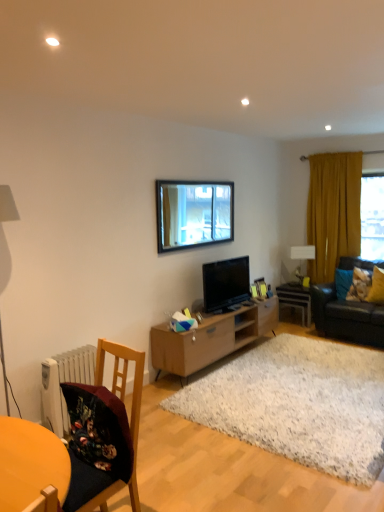
Question: Should I look upward or downward to see white glossy side table at center?

Choices:
 (A) up
 (B) down

Answer: (B)

Question: Is wooden picture frame at center, which is the 1th picture frame in left-to-right order, touching white glossy side table at center?

Choices:
 (A) yes
 (B) no

Answer: (B)

Question: Is wooden picture frame at center, placed as the 2th picture frame when sorted from right to left, at the right side of white glossy side table at center?

Choices:
 (A) yes
 (B) no

Answer: (B)

Question: Considering the relative sizes of wooden picture frame at center, placed as the 2th picture frame when sorted from right to left, and white glossy side table at center in the image provided, is wooden picture frame at center, placed as the 2th picture frame when sorted from right to left, smaller than white glossy side table at center?

Choices:
 (A) yes
 (B) no

Answer: (A)

Question: Is wooden picture frame at center, which is the 1th picture frame in left-to-right order, wider than white glossy side table at center?

Choices:
 (A) yes
 (B) no

Answer: (B)

Question: Considering the relative sizes of wooden picture frame at center, which is the 1th picture frame in left-to-right order, and white glossy side table at center in the image provided, is wooden picture frame at center, which is the 1th picture frame in left-to-right order, thinner than white glossy side table at center?

Choices:
 (A) yes
 (B) no

Answer: (A)

Question: Is white glossy side table at center a part of wooden picture frame at center, placed as the 2th picture frame when sorted from right to left?

Choices:
 (A) no
 (B) yes

Answer: (A)

Question: Is wooden chair at lower left positioned with its back to clear glass window at center?

Choices:
 (A) no
 (B) yes

Answer: (A)

Question: Is wooden chair at lower left surrounding clear glass window at center?

Choices:
 (A) yes
 (B) no

Answer: (B)

Question: Considering the relative sizes of wooden chair at lower left and clear glass window at center in the image provided, is wooden chair at lower left thinner than clear glass window at center?

Choices:
 (A) no
 (B) yes

Answer: (A)

Question: Is wooden chair at lower left shorter than clear glass window at center?

Choices:
 (A) no
 (B) yes

Answer: (A)

Question: From the image's perspective, is wooden chair at lower left located beneath clear glass window at center?

Choices:
 (A) no
 (B) yes

Answer: (B)

Question: From a real-world perspective, is wooden chair at lower left on top of clear glass window at center?

Choices:
 (A) yes
 (B) no

Answer: (B)

Question: Can you confirm if white shaggy rug at center is bigger than yellow fabric pillow at right, positioned as the 1th pillow in right-to-left order?

Choices:
 (A) yes
 (B) no

Answer: (A)